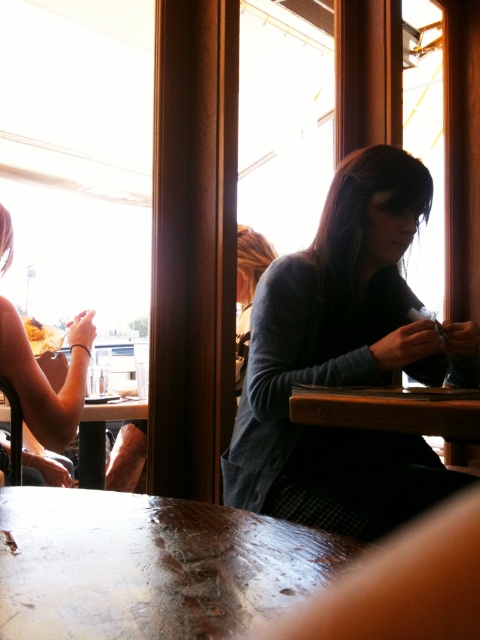
Does wooden table at lower center have a greater height compared to wooden table at lower left?

In fact, wooden table at lower center may be shorter than wooden table at lower left.

Does wooden table at lower center appear over wooden table at lower left?

Correct, wooden table at lower center is located above wooden table at lower left.

At what (x,y) coordinates should I click in order to perform the action: click on wooden table at lower center. Please return your answer as a coordinate pair (x, y). This screenshot has height=640, width=480. Looking at the image, I should click on (148, 564).

Find the location of a particular element. matte black shirt at left is located at coordinates (46, 376).

Does matte black shirt at left appear over wooden table at lower left?

Yes.

Between point (69, 476) and point (108, 410), which one is positioned in front?

Point (108, 410) is more forward.

This screenshot has width=480, height=640. What are the coordinates of `matte black shirt at left` in the screenshot? It's located at (46, 376).

Does wooden table at lower center appear on the left side of matte yellow food at lower left?

Incorrect, wooden table at lower center is not on the left side of matte yellow food at lower left.

Find the location of a particular element. wooden table at lower center is located at coordinates (148, 564).

The height and width of the screenshot is (640, 480). I want to click on wooden table at lower center, so click(148, 564).